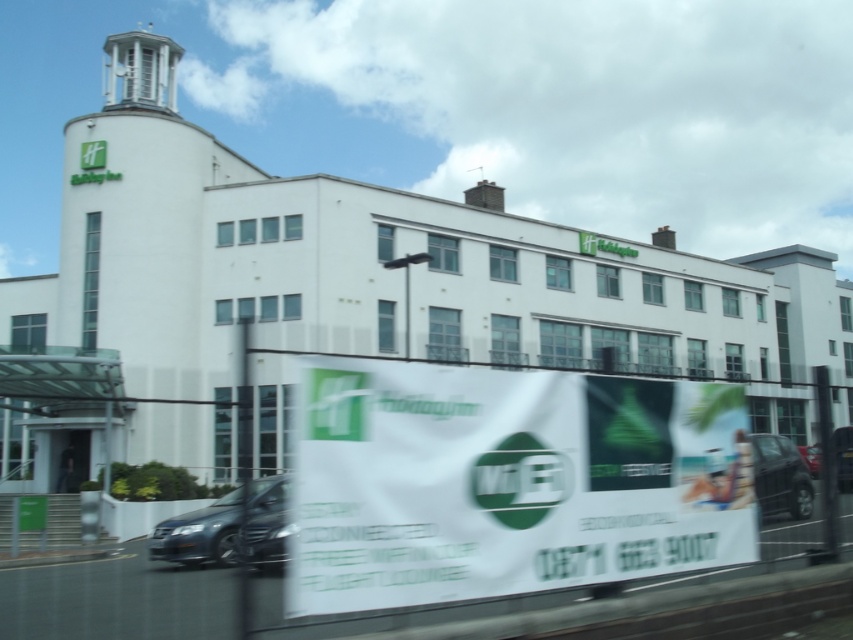
Is white fabric banner at center positioned behind shiny black car at lower right?

No, white fabric banner at center is in front of shiny black car at lower right.

Is white fabric banner at center to the right of shiny black car at lower right from the viewer's perspective?

Incorrect, white fabric banner at center is not on the right side of shiny black car at lower right.

I want to click on white fabric banner at center, so click(506, 483).

Where is `white fabric banner at center`? white fabric banner at center is located at coordinates (506, 483).

In the scene shown: Does shiny metallic car at lower left appear under shiny black car at lower right?

Correct, shiny metallic car at lower left is located below shiny black car at lower right.

Is point (184, 528) positioned behind point (772, 445)?

Yes.

Which is in front, point (263, 480) or point (764, 460)?

Point (764, 460) is in front.

Locate an element on the screen. shiny metallic car at lower left is located at coordinates (199, 532).

Who is shorter, white fabric banner at center or shiny metallic car at lower left?

Standing shorter between the two is white fabric banner at center.

Can you confirm if white fabric banner at center is thinner than shiny metallic car at lower left?

Yes.

This screenshot has height=640, width=853. What do you see at coordinates (506, 483) in the screenshot?
I see `white fabric banner at center` at bounding box center [506, 483].

This screenshot has height=640, width=853. Identify the location of white fabric banner at center. (506, 483).